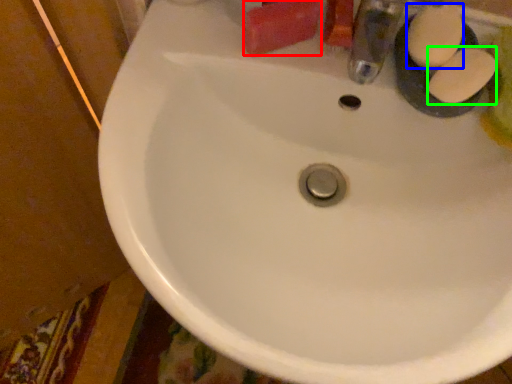
Question: Which object is the closest to the soap (highlighted by a red box)? Choose among these: soap (highlighted by a blue box) or soap (highlighted by a green box).

Choices:
 (A) soap
 (B) soap

Answer: (A)